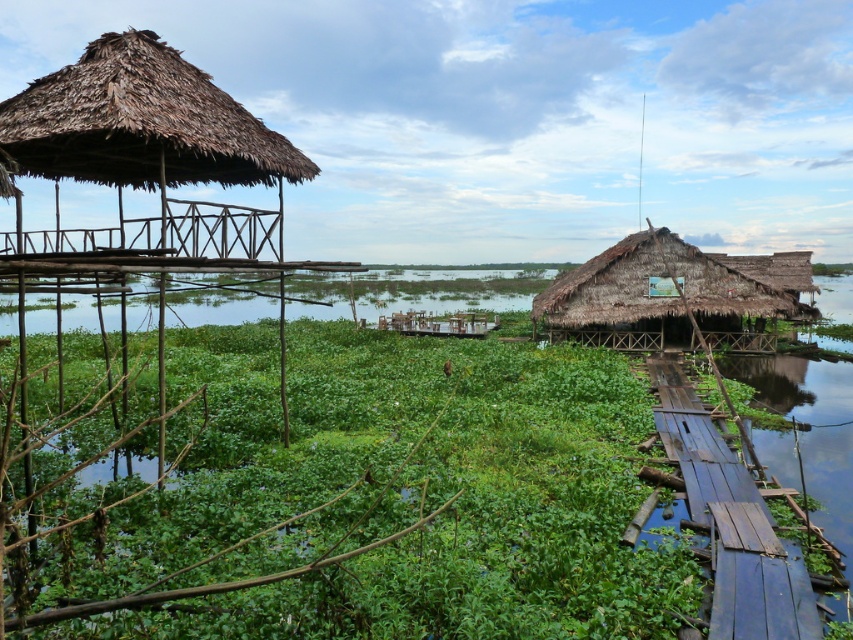
Between thatched bamboo hut at left and thatched straw hut at right, which one is positioned higher?

thatched bamboo hut at left is higher up.

The height and width of the screenshot is (640, 853). Find the location of `thatched bamboo hut at left`. thatched bamboo hut at left is located at coordinates (141, 122).

What do you see at coordinates (366, 497) in the screenshot? This screenshot has height=640, width=853. I see `green leafy plants at center` at bounding box center [366, 497].

Who is lower down, green leafy plants at center or thatched bamboo hut at left?

Positioned lower is green leafy plants at center.

Who is more distant from viewer, (172, 388) or (212, 115)?

Positioned behind is point (172, 388).

Locate an element on the screen. Image resolution: width=853 pixels, height=640 pixels. green leafy plants at center is located at coordinates (366, 497).

Identify the location of green leafy plants at center. (366, 497).

Can you confirm if green leafy plants at center is bigger than thatched straw hut at right?

No.

Measure the distance between green leafy plants at center and camera.

green leafy plants at center is 3.46 meters from camera.

The image size is (853, 640). I want to click on green leafy plants at center, so click(366, 497).